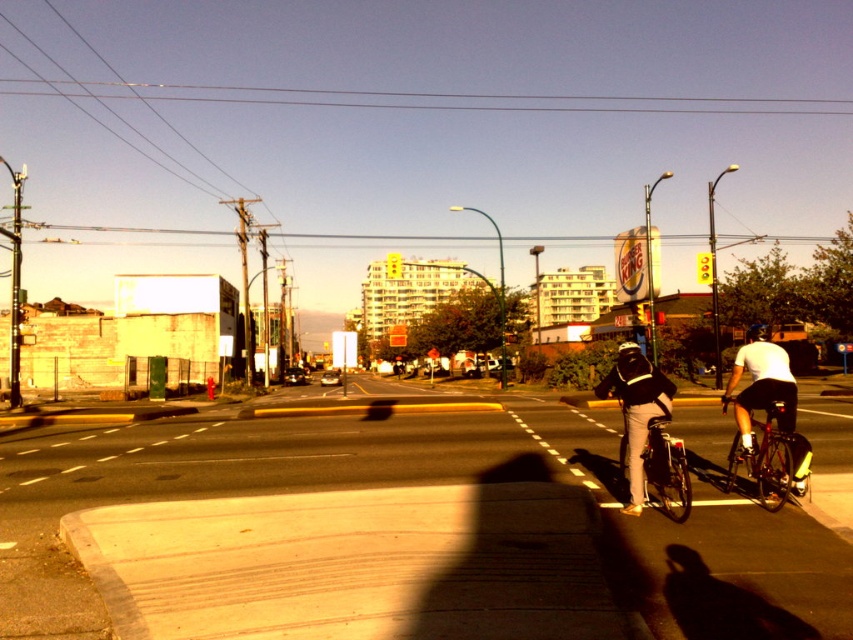
You are a pedestrian standing on the sidewalk and see the shiny black bicycle at center and the black matte bicycle helmet at center. Which object is higher up in the image?

The black matte bicycle helmet at center is higher up in the image because the shiny black bicycle at center is located below it.

You are a delivery person who needs to load a package onto the shiny black bicycle at center and the black matte bicycle helmet at center. Which object can you place the package on top of without it falling off?

The shiny black bicycle at center is taller than the black matte bicycle helmet at center, so placing the package on top of the shiny black bicycle at center would be more stable and less likely to fall off.

You are a delivery person who needs to place a package on the shiny black bicycle at right. The package requires a distance of at least 2 meters from the black matte bicycle helmet at center to avoid obstruction. Can you safely place the package on the bicycle?

The shiny black bicycle at right is 2.05 meters from the black matte bicycle helmet at center. Since 2.05 meters meets the required minimum distance of 2 meters, you can safely place the package on the shiny black bicycle at right without obstruction.